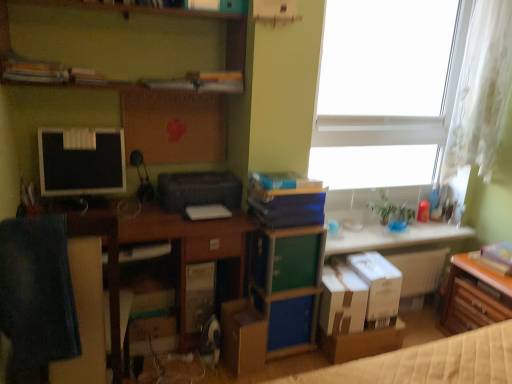
Question: From a real-world perspective, is white sheer curtain at upper right below brown cardboard box at lower right, acting as the 1th cardboard box starting from the right?

Choices:
 (A) yes
 (B) no

Answer: (B)

Question: Is brown cardboard box at lower right, which appears as the 4th cardboard box when viewed from the left, located within white sheer curtain at upper right?

Choices:
 (A) yes
 (B) no

Answer: (B)

Question: Is white sheer curtain at upper right thinner than brown cardboard box at lower right, acting as the 1th cardboard box starting from the right?

Choices:
 (A) no
 (B) yes

Answer: (B)

Question: Is white sheer curtain at upper right to the left of brown cardboard box at lower right, acting as the 1th cardboard box starting from the right, from the viewer's perspective?

Choices:
 (A) no
 (B) yes

Answer: (A)

Question: Does white sheer curtain at upper right have a larger size compared to brown cardboard box at lower right, which appears as the 4th cardboard box when viewed from the left?

Choices:
 (A) no
 (B) yes

Answer: (B)

Question: From the image's perspective, is white sheer curtain at upper right below brown cardboard box at lower right, acting as the 1th cardboard box starting from the right?

Choices:
 (A) no
 (B) yes

Answer: (A)

Question: Is wooden desk at lower left at the right side of matte black monitor at left?

Choices:
 (A) no
 (B) yes

Answer: (B)

Question: Does wooden desk at lower left have a greater width compared to matte black monitor at left?

Choices:
 (A) yes
 (B) no

Answer: (A)

Question: Is wooden desk at lower left positioned in front of matte black monitor at left?

Choices:
 (A) yes
 (B) no

Answer: (A)

Question: Considering the relative sizes of wooden desk at lower left and matte black monitor at left in the image provided, is wooden desk at lower left taller than matte black monitor at left?

Choices:
 (A) yes
 (B) no

Answer: (A)

Question: From a real-world perspective, is wooden desk at lower left physically below matte black monitor at left?

Choices:
 (A) yes
 (B) no

Answer: (A)

Question: From a real-world perspective, is wooden desk at lower left on matte black monitor at left?

Choices:
 (A) yes
 (B) no

Answer: (B)

Question: From a real-world perspective, is black plastic printer at center over brown cardboard box at lower right, acting as the 1th cardboard box starting from the right?

Choices:
 (A) yes
 (B) no

Answer: (A)